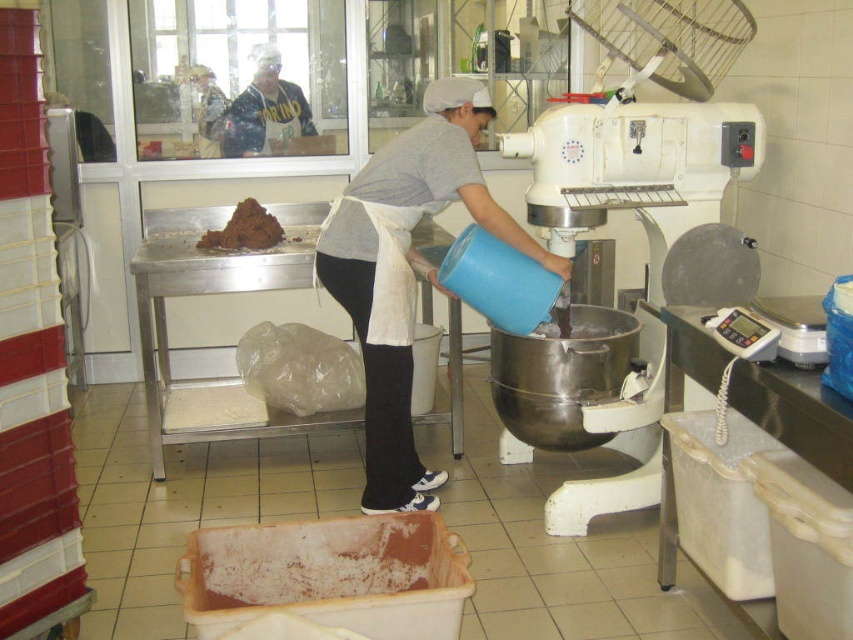
Question: Is stainless steel mixer at center positioned behind brown matte container at lower center?

Choices:
 (A) yes
 (B) no

Answer: (A)

Question: Can you confirm if stainless steel mixer at center is positioned to the left of brown matte container at lower center?

Choices:
 (A) yes
 (B) no

Answer: (B)

Question: Which point appears farthest from the camera in this image?

Choices:
 (A) (579, 125)
 (B) (271, 54)

Answer: (B)

Question: From the image, what is the correct spatial relationship of brown matte container at lower center in relation to matte yellow shirt at upper left?

Choices:
 (A) right
 (B) left

Answer: (A)

Question: Which object appears closest to the camera in this image?

Choices:
 (A) stainless steel mixer at center
 (B) blue matte bucket at center
 (C) matte yellow shirt at upper left

Answer: (A)

Question: Which object is positioned farthest from the brown matte container at lower center?

Choices:
 (A) matte yellow shirt at upper left
 (B) brown crumbly dough at upper center
 (C) stainless steel mixer at center
 (D) blue matte bucket at center

Answer: (A)